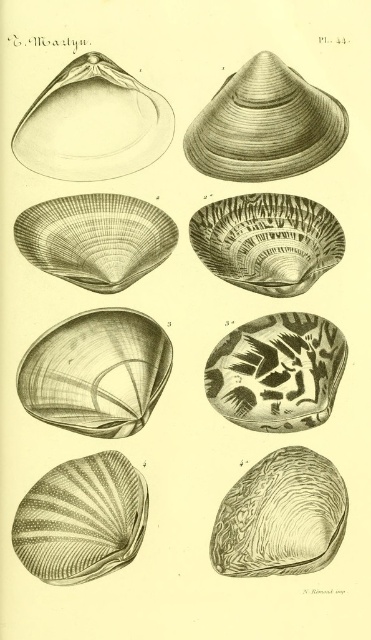
Between smooth brown shell at upper center and speckled stone shell at center, which one is positioned higher?

smooth brown shell at upper center

Between point (255, 179) and point (228, 346), which one is positioned in front?

Point (228, 346) is more forward.

This screenshot has width=371, height=640. I want to click on smooth brown shell at upper center, so click(264, 124).

Is point (221, 564) behind point (228, 356)?

That is False.

I want to click on smooth brown shell at bottom right, so click(280, 516).

Is point (54, 380) in front of point (294, 512)?

No, it is behind (294, 512).

Does point (63, 388) come behind point (257, 525)?

Yes, point (63, 388) is behind point (257, 525).

The image size is (371, 640). I want to click on smooth brown shell at center, so click(96, 372).